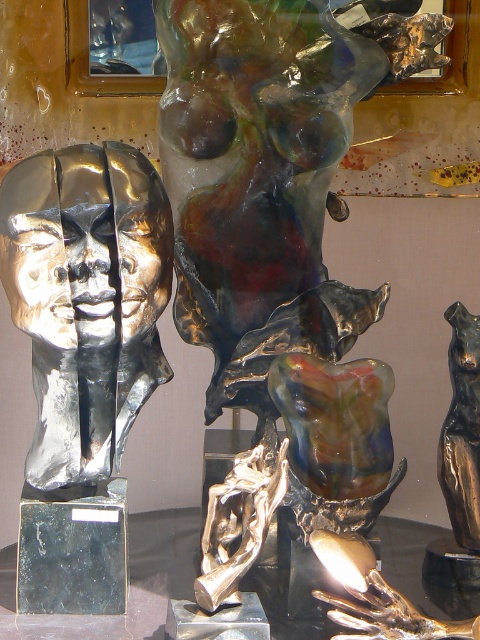
What do you see at coordinates (273, 232) in the screenshot? I see `shiny bronze sculpture at center` at bounding box center [273, 232].

Does shiny bronze sculpture at center appear over shiny metallic head at left?

No, shiny bronze sculpture at center is not above shiny metallic head at left.

Locate an element on the screen. Image resolution: width=480 pixels, height=640 pixels. shiny bronze sculpture at center is located at coordinates (273, 232).

Identify the location of shiny bronze sculpture at center. The image size is (480, 640). (273, 232).